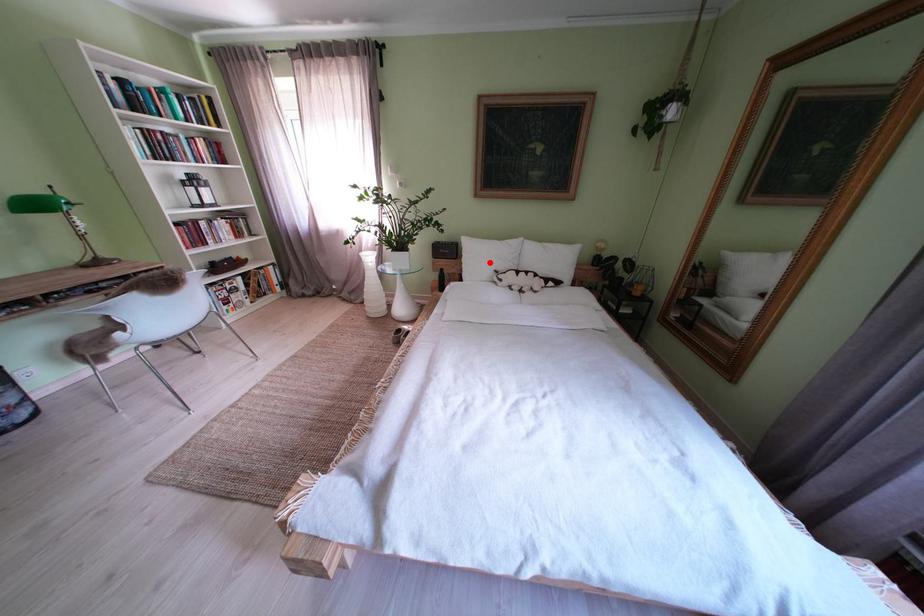
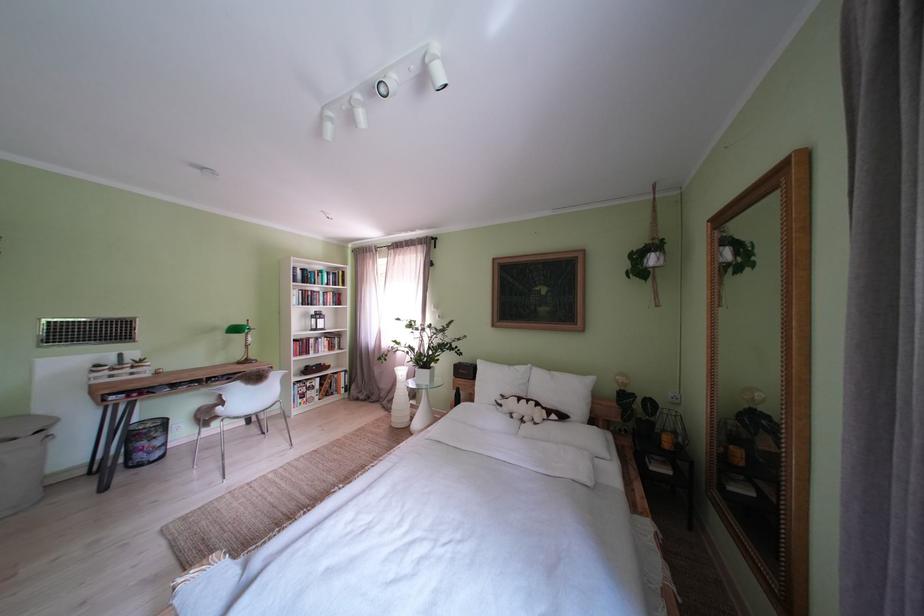
Question: A red point is marked in image1. In image2, is the corresponding 3D point closer to the camera or farther? Reply with the corresponding letter.

Choices:
 (A) The corresponding 3D point is closer.
 (B) The corresponding 3D point is farther.

Answer: (B)